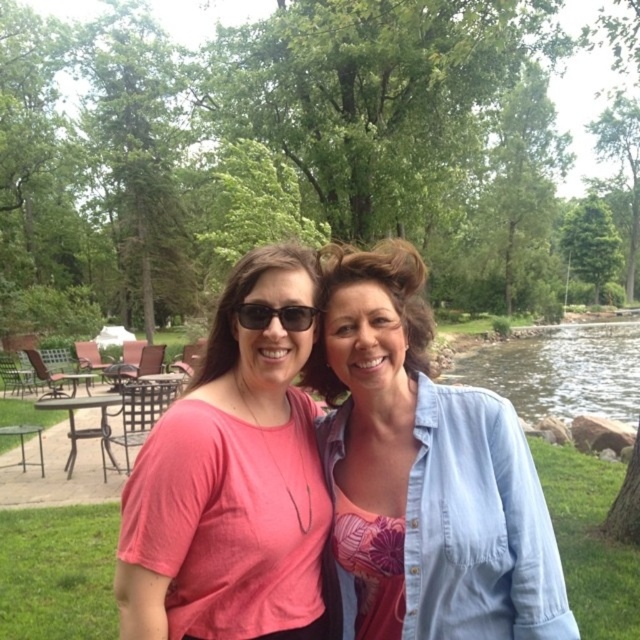
You are a photographer standing at the center of the scene. You want to take a photo of the clear water at right without the matte black sunglasses at center appearing in the frame. Is this possible given their distance?

The clear water at right and matte black sunglasses at center are 21.72 meters apart. Since the sunglasses are at the center and the water is at the right, the photographer can position themselves to frame the shot so that the sunglasses are not in the view while capturing the water, as they are sufficiently distant from each other.

You are a photographer trying to capture a closeup shot of the light blue denim shirt at center and the matte black sunglasses at center. Your camera has a minimum focusing distance of 12 inches. Can you take the photo without moving either object?

The distance between the light blue denim shirt at center and matte black sunglasses at center is 13.67 inches, which is greater than the camera minimum focusing distance of 12 inches. Therefore, you can take the photo without moving either object.

You are planning to take a photo of the light blue denim shirt at center and the brown metal picnic table at lower left. Which object is closer to the right edge of the image?

The light blue denim shirt at center is positioned on the right side of the brown metal picnic table at lower left, so it is closer to the right edge of the image.